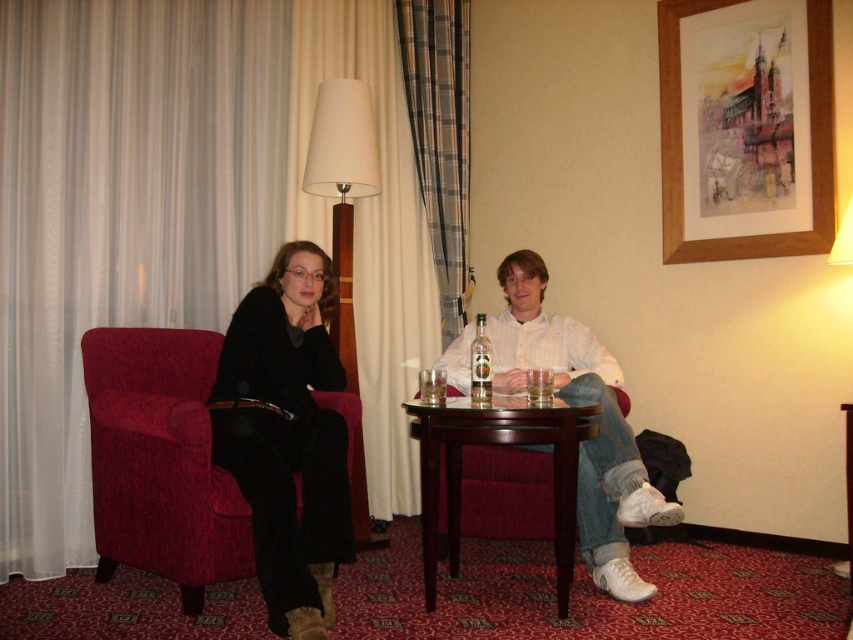
Question: Which point is closer to the camera?

Choices:
 (A) clear glass water at table center
 (B) clear glass bottle at center
 (C) translucent glass at table center

Answer: (B)

Question: Can you confirm if mahogany wood table at center is bigger than clear glass bottle at center?

Choices:
 (A) yes
 (B) no

Answer: (A)

Question: Can you confirm if velvet black coat at left is smaller than white cotton shirt at center?

Choices:
 (A) yes
 (B) no

Answer: (A)

Question: Is matte black jacket at center positioned behind translucent glass at table center?

Choices:
 (A) no
 (B) yes

Answer: (A)

Question: Which is farther from the mahogany wood table at center?

Choices:
 (A) clear glass water at table center
 (B) plaid fabric curtain at center
 (C) velvet black coat at left

Answer: (B)

Question: Which is nearer to the matte black jacket at center?

Choices:
 (A) velvet-like red armchair at left
 (B) plaid fabric curtain at center
 (C) clear glass bottle at center

Answer: (A)